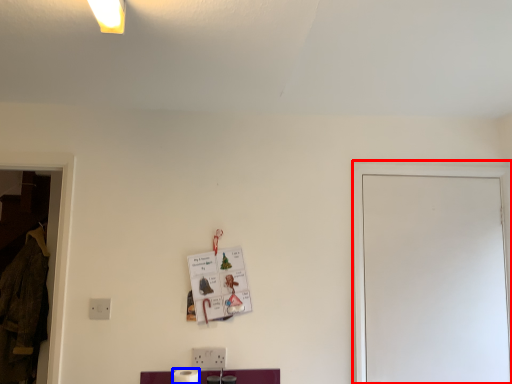
Question: Which point is closer to the camera, glass door (highlighted by a red box) or toilet paper (highlighted by a blue box)?

Choices:
 (A) glass door
 (B) toilet paper

Answer: (B)